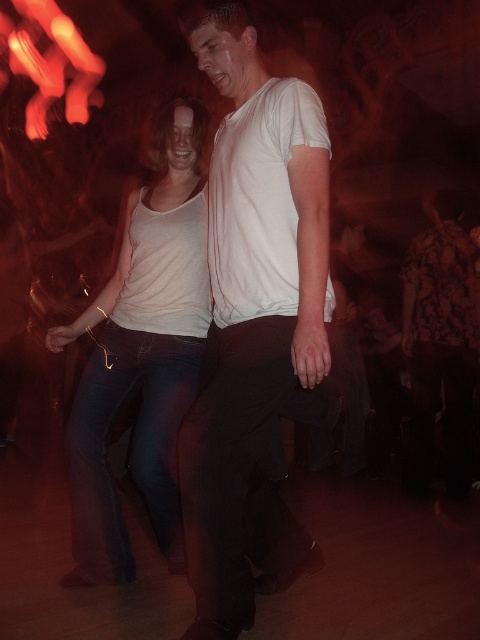
Question: Does white matte t-shirt at center have a lesser width compared to white matte tank top at center?

Choices:
 (A) no
 (B) yes

Answer: (B)

Question: Is white matte t-shirt at center positioned before white matte tank top at center?

Choices:
 (A) yes
 (B) no

Answer: (A)

Question: Does white matte t-shirt at center have a lesser width compared to white matte tank top at center?

Choices:
 (A) yes
 (B) no

Answer: (A)